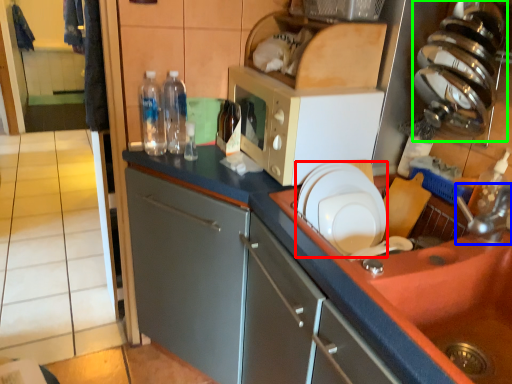
Question: Which is farther away from plate (highlighted by a red box)? faucet (highlighted by a blue box) or appliance (highlighted by a green box)?

Choices:
 (A) faucet
 (B) appliance

Answer: (B)